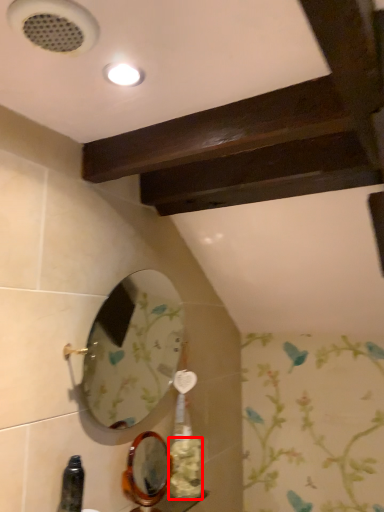
Question: From the image's perspective, considering the relative positions of flower (annotated by the red box) and mirror in the image provided, where is flower (annotated by the red box) located with respect to the staircase?

Choices:
 (A) below
 (B) above

Answer: (A)